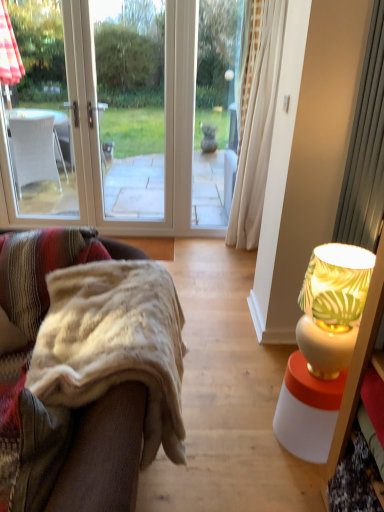
Measure the distance between point (157, 332) and camera.

Point (157, 332) is 4.10 feet from camera.

What do you see at coordinates (81, 356) in the screenshot? I see `fuzzy beige blanket at left` at bounding box center [81, 356].

Locate an element on the screen. fuzzy beige blanket at left is located at coordinates (81, 356).

Describe the element at coordinates (332, 306) in the screenshot. I see `white ceramic lamp at right` at that location.

I want to click on white ceramic lamp at right, so click(332, 306).

Measure the distance between point (362, 303) and camera.

4.80 feet.

Identify the location of fuzzy beige blanket at left. This screenshot has height=512, width=384. (81, 356).

Is white ceramic lamp at right at the right side of fuzzy beige blanket at left?

Yes, white ceramic lamp at right is to the right of fuzzy beige blanket at left.

Considering their positions, is white ceramic lamp at right located in front of or behind fuzzy beige blanket at left?

In the image, white ceramic lamp at right appears behind fuzzy beige blanket at left.

Is point (330, 352) less distant than point (143, 463)?

No.

From the image's perspective, is white ceramic lamp at right above or below fuzzy beige blanket at left?

white ceramic lamp at right is above fuzzy beige blanket at left.

From a real-world perspective, is white ceramic lamp at right above or below fuzzy beige blanket at left?

white ceramic lamp at right is above fuzzy beige blanket at left.

Between white ceramic lamp at right and fuzzy beige blanket at left, which one has larger width?

fuzzy beige blanket at left is wider.

Between white ceramic lamp at right and fuzzy beige blanket at left, which one has less height?

fuzzy beige blanket at left is shorter.

Is white ceramic lamp at right bigger than fuzzy beige blanket at left?

Incorrect, white ceramic lamp at right is not larger than fuzzy beige blanket at left.

Is white ceramic lamp at right situated inside fuzzy beige blanket at left or outside?

white ceramic lamp at right is not enclosed by fuzzy beige blanket at left.

Are white ceramic lamp at right and fuzzy beige blanket at left far apart?

No, white ceramic lamp at right is not far from fuzzy beige blanket at left.

Consider the image. Is white ceramic lamp at right looking in the opposite direction of fuzzy beige blanket at left?

No, white ceramic lamp at right is not facing away from fuzzy beige blanket at left.

Can you tell me how much white ceramic lamp at right and fuzzy beige blanket at left differ in facing direction?

0.115 degrees.

At what (x,y) coordinates should I click in order to perform the action: click on lamp above the fuzzy beige blanket at left (from a real-world perspective). Please return your answer as a coordinate pair (x, y). Looking at the image, I should click on (332, 306).

Considering the positions of objects fuzzy beige blanket at left and white ceramic lamp at right in the image provided, who is more to the left, fuzzy beige blanket at left or white ceramic lamp at right?

From the viewer's perspective, fuzzy beige blanket at left appears more on the left side.

From the picture: Considering the relative positions of fuzzy beige blanket at left and white ceramic lamp at right in the image provided, is fuzzy beige blanket at left in front of white ceramic lamp at right?

Yes, it is.

Is point (76, 486) positioned in front of point (348, 316)?

Yes, it is.

From the image's perspective, is fuzzy beige blanket at left located above or below white ceramic lamp at right?

Based on their image positions, fuzzy beige blanket at left is located beneath white ceramic lamp at right.

From a real-world perspective, is fuzzy beige blanket at left located beneath white ceramic lamp at right?

Correct, in the physical world, fuzzy beige blanket at left is lower than white ceramic lamp at right.

Is fuzzy beige blanket at left thinner than white ceramic lamp at right?

In fact, fuzzy beige blanket at left might be wider than white ceramic lamp at right.

Considering the sizes of objects fuzzy beige blanket at left and white ceramic lamp at right in the image provided, who is taller, fuzzy beige blanket at left or white ceramic lamp at right?

Standing taller between the two is white ceramic lamp at right.

Who is bigger, fuzzy beige blanket at left or white ceramic lamp at right?

With larger size is fuzzy beige blanket at left.

Is fuzzy beige blanket at left located outside white ceramic lamp at right?

Yes, fuzzy beige blanket at left is located beyond the bounds of white ceramic lamp at right.

Are fuzzy beige blanket at left and white ceramic lamp at right making contact?

No.

Is fuzzy beige blanket at left facing away from white ceramic lamp at right?

That's right, fuzzy beige blanket at left is facing away from white ceramic lamp at right.

How many degrees apart are the facing directions of fuzzy beige blanket at left and white ceramic lamp at right?

The angle between the facing direction of fuzzy beige blanket at left and the facing direction of white ceramic lamp at right is 0.115 degrees.

How far apart are fuzzy beige blanket at left and white ceramic lamp at right?

fuzzy beige blanket at left is 28.87 inches away from white ceramic lamp at right.

I want to click on studio couch located underneath the white ceramic lamp at right (from a real-world perspective), so click(81, 356).

Find the location of a particular element. The image size is (384, 512). lamp that is on the right side of fuzzy beige blanket at left is located at coordinates (332, 306).

Identify the location of studio couch below the white ceramic lamp at right (from the image's perspective). (81, 356).